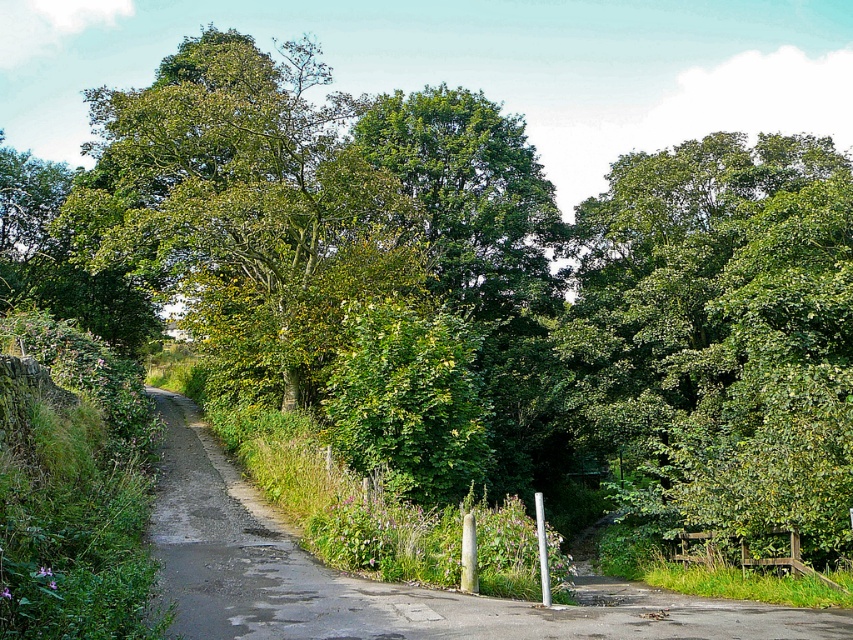
Question: Among these objects, which one is nearest to the camera?

Choices:
 (A) green leafy tree at center
 (B) green leafy tree at upper right

Answer: (B)

Question: Does green leafy tree at center have a larger size compared to green leafy hedge at center?

Choices:
 (A) yes
 (B) no

Answer: (A)

Question: Can you confirm if green leafy tree at upper right is smaller than green leafy hedge at center?

Choices:
 (A) no
 (B) yes

Answer: (A)

Question: Which of the following is the farthest from the observer?

Choices:
 (A) green leafy tree at upper right
 (B) green leafy hedge at center
 (C) green leafy tree at center

Answer: (C)

Question: Is green leafy tree at upper right to the left of green leafy hedge at center from the viewer's perspective?

Choices:
 (A) no
 (B) yes

Answer: (A)

Question: Which of the following is the closest to the observer?

Choices:
 (A) green leafy tree at upper right
 (B) green leafy hedge at center
 (C) green leafy tree at center

Answer: (B)